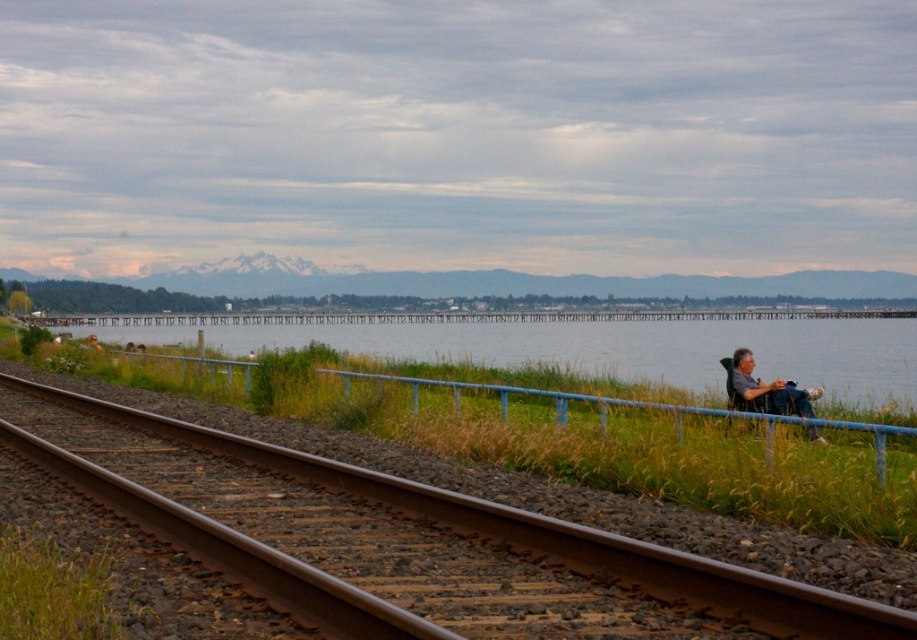
Question: Can you confirm if clear blue water at center is positioned to the right of green grass at lower left?

Choices:
 (A) no
 (B) yes

Answer: (B)

Question: Considering the real-world distances, which object is farthest from the gray fabric chair at right?

Choices:
 (A) clear blue water at center
 (B) green grass at lower left
 (C) brown metal track at lower left

Answer: (A)

Question: Which object appears closest to the camera in this image?

Choices:
 (A) green grass at lower left
 (B) clear blue water at center
 (C) gray fabric chair at right

Answer: (A)

Question: Can you confirm if clear blue water at center is wider than gray fabric chair at right?

Choices:
 (A) yes
 (B) no

Answer: (A)

Question: Which of the following is the farthest from the observer?

Choices:
 (A) clear blue water at center
 (B) green grass at lower left

Answer: (A)

Question: Observing the image, what is the correct spatial positioning of clear blue water at center in reference to green grass at lower left?

Choices:
 (A) right
 (B) left

Answer: (A)